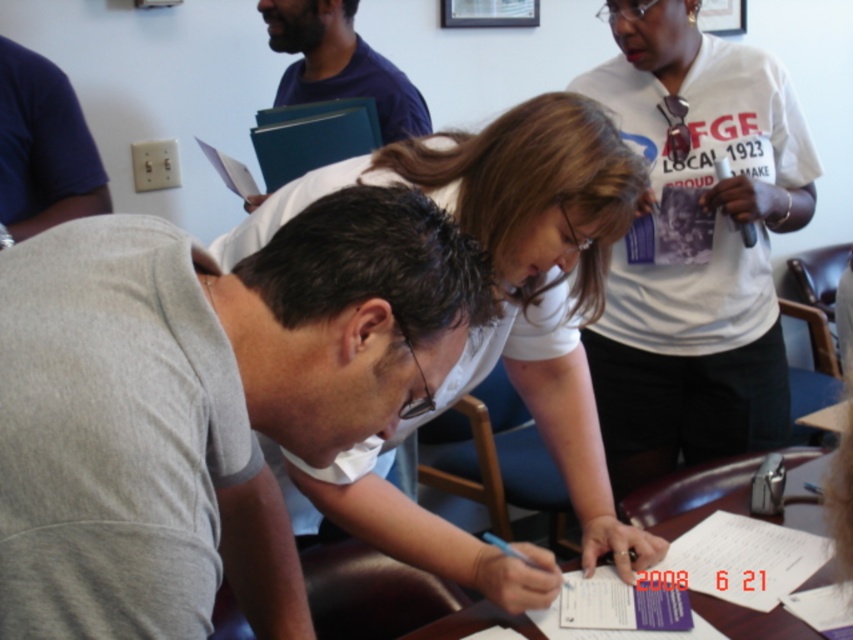
Is gray matte shirt at center closer to the viewer compared to white matte shirt at center?

Yes, it is in front of white matte shirt at center.

Which of these two, gray matte shirt at center or white matte shirt at center, stands shorter?

gray matte shirt at center

Measure the distance between point (138, 292) and camera.

25.50 inches

Identify the location of gray matte shirt at center. This screenshot has width=853, height=640. (196, 392).

Does gray matte shirt at center appear over blue fabric folder at upper center?

No.

Between point (224, 486) and point (416, 112), which one is positioned in front?

Point (224, 486) is in front.

Does point (340, 381) come farther from viewer compared to point (309, 8)?

No.

Find the location of a particular element. This screenshot has height=640, width=853. gray matte shirt at center is located at coordinates [196, 392].

Does white cotton t-shirt at upper right have a larger size compared to blue fabric folder at upper center?

Indeed, white cotton t-shirt at upper right has a larger size compared to blue fabric folder at upper center.

How much distance is there between white cotton t-shirt at upper right and blue fabric folder at upper center?

A distance of 27.79 inches exists between white cotton t-shirt at upper right and blue fabric folder at upper center.

Who is more forward, (692, 317) or (370, 54)?

Point (692, 317)

I want to click on white cotton t-shirt at upper right, so click(x=711, y=250).